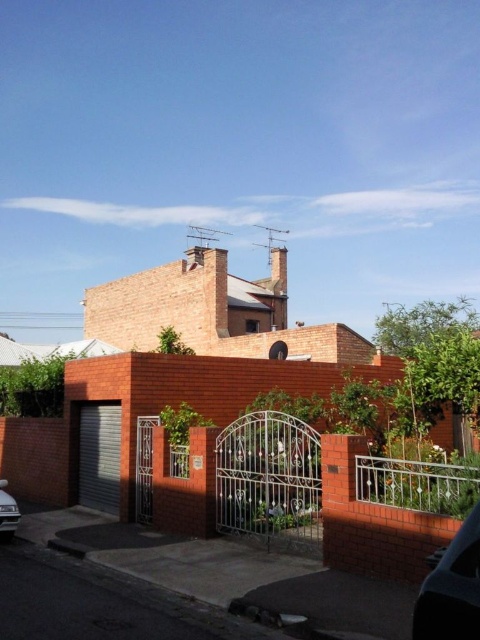
Which of these two, shiny black car at lower right or shiny silver car at lower left, stands shorter?

Standing shorter between the two is shiny black car at lower right.

Where is `shiny black car at lower right`? shiny black car at lower right is located at coordinates (452, 588).

At what (x,y) coordinates should I click in order to perform the action: click on shiny black car at lower right. Please return your answer as a coordinate pair (x, y). Looking at the image, I should click on (452, 588).

Find the location of a particular element. This screenshot has width=480, height=640. shiny black car at lower right is located at coordinates (452, 588).